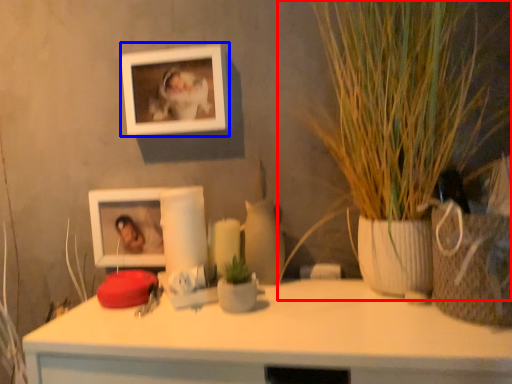
Question: Which object appears farthest to the camera in this image, houseplant (highlighted by a red box) or picture frame (highlighted by a blue box)?

Choices:
 (A) houseplant
 (B) picture frame

Answer: (B)